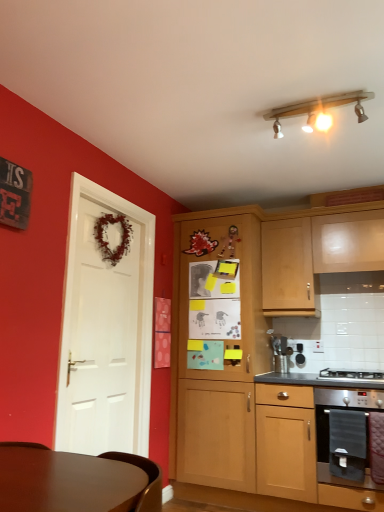
Question: Does wooden cabinet at center, the third cabinetry positioned from the right, come behind stainless steel oven at lower right, arranged as the second cabinetry when viewed from the right?

Choices:
 (A) no
 (B) yes

Answer: (B)

Question: Can you confirm if wooden cabinet at center, the third cabinetry positioned from the right, is positioned to the left of stainless steel oven at lower right, arranged as the second cabinetry when viewed from the right?

Choices:
 (A) no
 (B) yes

Answer: (B)

Question: Is wooden cabinet at center, the third cabinetry positioned from the right, not inside stainless steel oven at lower right, which is the second cabinetry in left-to-right order?

Choices:
 (A) yes
 (B) no

Answer: (A)

Question: Are wooden cabinet at center, the third cabinetry positioned from the right, and stainless steel oven at lower right, which is the second cabinetry in left-to-right order, making contact?

Choices:
 (A) no
 (B) yes

Answer: (A)

Question: Can you confirm if wooden cabinet at center, the 1th cabinetry viewed from the left, is shorter than stainless steel oven at lower right, which is the second cabinetry in left-to-right order?

Choices:
 (A) no
 (B) yes

Answer: (A)

Question: Visually, is white matte door at left positioned to the left or to the right of wooden cabinet at center, the 1th cabinetry viewed from the left?

Choices:
 (A) right
 (B) left

Answer: (B)

Question: Is point (132, 274) positioned closer to the camera than point (195, 301)?

Choices:
 (A) farther
 (B) closer

Answer: (B)

Question: From a real-world perspective, is white matte door at left physically located above or below wooden cabinet at center, the third cabinetry positioned from the right?

Choices:
 (A) above
 (B) below

Answer: (A)

Question: Considering the positions of white matte door at left and wooden cabinet at center, the 1th cabinetry viewed from the left, in the image, is white matte door at left bigger or smaller than wooden cabinet at center, the 1th cabinetry viewed from the left,?

Choices:
 (A) small
 (B) big

Answer: (A)

Question: From their relative heights in the image, would you say stainless steel gas stove at lower right is taller or shorter than wooden track light at upper center?

Choices:
 (A) short
 (B) tall

Answer: (A)

Question: From a real-world perspective, is stainless steel gas stove at lower right positioned above or below wooden track light at upper center?

Choices:
 (A) below
 (B) above

Answer: (A)

Question: From the image's perspective, relative to wooden track light at upper center, is stainless steel gas stove at lower right above or below?

Choices:
 (A) below
 (B) above

Answer: (A)

Question: Would you say stainless steel gas stove at lower right is to the left or to the right of wooden track light at upper center in the picture?

Choices:
 (A) right
 (B) left

Answer: (A)

Question: In the image, is wooden cabinet at center, the third cabinetry positioned from the right, positioned in front of or behind stainless steel oven at lower right?

Choices:
 (A) front
 (B) behind

Answer: (B)

Question: Considering the positions of point (208, 410) and point (377, 400), is point (208, 410) closer or farther from the camera than point (377, 400)?

Choices:
 (A) closer
 (B) farther

Answer: (B)